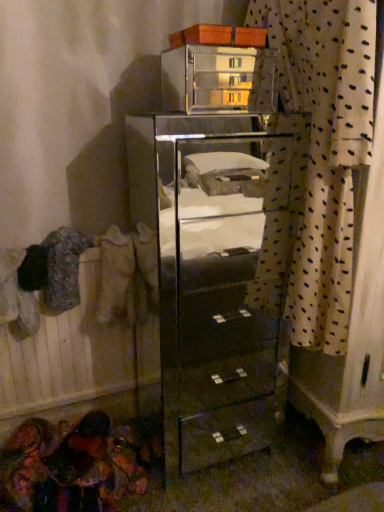
At what (x,y) coordinates should I click in order to perform the action: click on clear glass cabinet at center. Please return your answer as a coordinate pair (x, y). Looking at the image, I should click on (208, 286).

Measure the distance between point (111, 243) and camera.

The distance of point (111, 243) from camera is 1.40 meters.

This screenshot has width=384, height=512. In order to click on clear glass cabinet at center in this screenshot , I will do `click(208, 286)`.

Is clear glass cabinet at upper center not near white dotted fabric at right?

Indeed, clear glass cabinet at upper center is not near white dotted fabric at right.

Who is taller, clear glass cabinet at upper center or white dotted fabric at right?

Standing taller between the two is white dotted fabric at right.

What's the angular difference between clear glass cabinet at upper center and white dotted fabric at right's facing directions?

94.2 degrees.

Which of these two, white dotted fabric at right or beige fabric at left, is smaller?

beige fabric at left is smaller.

Is white dotted fabric at right placed right next to beige fabric at left?

No, white dotted fabric at right is not in contact with beige fabric at left.

From the image's perspective, would you say white dotted fabric at right is shown under beige fabric at left?

Actually, white dotted fabric at right appears above beige fabric at left in the image.

Is white dotted fabric at right closer to the viewer compared to beige fabric at left?

Yes.

Considering the sizes of objects clear glass cabinet at center and white dotted fabric at right in the image provided, who is wider, clear glass cabinet at center or white dotted fabric at right?

clear glass cabinet at center is wider.

Can you tell me how much clear glass cabinet at center and white dotted fabric at right differ in facing direction?

90 degrees.

Which point is more distant from viewer, (255, 242) or (296, 76)?

The point (255, 242) is farther from the camera.

Is clear glass cabinet at center turned away from white dotted fabric at right?

Absolutely, clear glass cabinet at center is directed away from white dotted fabric at right.

Where is `furniture lying on the right of clear glass cabinet at center`? Image resolution: width=384 pixels, height=512 pixels. furniture lying on the right of clear glass cabinet at center is located at coordinates (219, 79).

From the image's perspective, is clear glass cabinet at upper center positioned above or below clear glass cabinet at center?

clear glass cabinet at upper center is above clear glass cabinet at center.

Would you say clear glass cabinet at upper center is to the left or to the right of clear glass cabinet at center in the picture?

clear glass cabinet at upper center is positioned on clear glass cabinet at center's right side.

From the picture: Is clear glass cabinet at upper center inside the boundaries of clear glass cabinet at center, or outside?

clear glass cabinet at upper center is outside clear glass cabinet at center.

Does white dotted fabric at right have a lesser width compared to clear glass cabinet at center?

Yes.

Which is correct: white dotted fabric at right is inside clear glass cabinet at center, or outside of it?

white dotted fabric at right is not enclosed by clear glass cabinet at center.

Does point (335, 187) come closer to viewer compared to point (204, 333)?

That is True.

Measure the distance between white dotted fabric at right and clear glass cabinet at center.

white dotted fabric at right is 73.09 centimeters from clear glass cabinet at center.

Is point (102, 306) farther from camera compared to point (361, 96)?

Yes, it is behind point (361, 96).

From the image's perspective, is beige fabric at left above or below white dotted fabric at right?

From the image's perspective, beige fabric at left appears below white dotted fabric at right.

From the picture: Is white dotted fabric at right a part of beige fabric at left?

Actually, white dotted fabric at right is outside beige fabric at left.

Is beige fabric at left in contact with white dotted fabric at right?

beige fabric at left and white dotted fabric at right are not in contact.

Based on the photo, can you tell me how much clear glass cabinet at center and beige fabric at left differ in facing direction?

The facing directions of clear glass cabinet at center and beige fabric at left are 0.0923 degrees apart.

Is clear glass cabinet at center in front of or behind beige fabric at left in the image?

clear glass cabinet at center is positioned closer to the viewer than beige fabric at left.

In the scene shown: Does clear glass cabinet at center have a greater height compared to beige fabric at left?

Yes, clear glass cabinet at center is taller than beige fabric at left.

Would you say clear glass cabinet at center is outside beige fabric at left?

Yes.

Locate an element on the screen. The height and width of the screenshot is (512, 384). furniture on the left of white dotted fabric at right is located at coordinates (219, 79).

This screenshot has width=384, height=512. I want to click on clothing beneath the white dotted fabric at right (from a real-world perspective), so point(115,276).

Considering their positions, is clear glass cabinet at upper center positioned closer to white dotted fabric at right than beige fabric at left?

The object closer to white dotted fabric at right is beige fabric at left.

Considering their positions, is clear glass cabinet at center positioned closer to clear glass cabinet at upper center than white dotted fabric at right?

clear glass cabinet at center is positioned closer to the anchor clear glass cabinet at upper center.

When comparing their distances from beige fabric at left, does clear glass cabinet at center or white dotted fabric at right seem closer?

white dotted fabric at right is closer to beige fabric at left.

When comparing their distances from clear glass cabinet at upper center, does clear glass cabinet at center or beige fabric at left seem further?

beige fabric at left is further to clear glass cabinet at upper center.

Looking at this image, estimate the real-world distances between objects in this image. Which object is further from clear glass cabinet at upper center, white dotted fabric at right or clear glass cabinet at center?

white dotted fabric at right is further to clear glass cabinet at upper center.

Considering their positions, is clear glass cabinet at upper center positioned further to clear glass cabinet at center than white dotted fabric at right?

The object further to clear glass cabinet at center is clear glass cabinet at upper center.

When comparing their distances from white dotted fabric at right, does beige fabric at left or clear glass cabinet at center seem further?

Based on the image, clear glass cabinet at center appears to be further to white dotted fabric at right.

Which object lies further to the anchor point beige fabric at left, white dotted fabric at right or clear glass cabinet at upper center?

clear glass cabinet at upper center.

This screenshot has width=384, height=512. Find the location of `furniture between beige fabric at left and white dotted fabric at right`. furniture between beige fabric at left and white dotted fabric at right is located at coordinates (219, 79).

Where is `clothing between clear glass cabinet at upper center and clear glass cabinet at center in the vertical direction`? The width and height of the screenshot is (384, 512). clothing between clear glass cabinet at upper center and clear glass cabinet at center in the vertical direction is located at coordinates (115, 276).

Image resolution: width=384 pixels, height=512 pixels. What are the coordinates of `chest of drawers between beige fabric at left and white dotted fabric at right` in the screenshot? It's located at (208, 286).

Where is `curtain that lies between clear glass cabinet at upper center and clear glass cabinet at center from top to bottom`? Image resolution: width=384 pixels, height=512 pixels. curtain that lies between clear glass cabinet at upper center and clear glass cabinet at center from top to bottom is located at coordinates (323, 150).